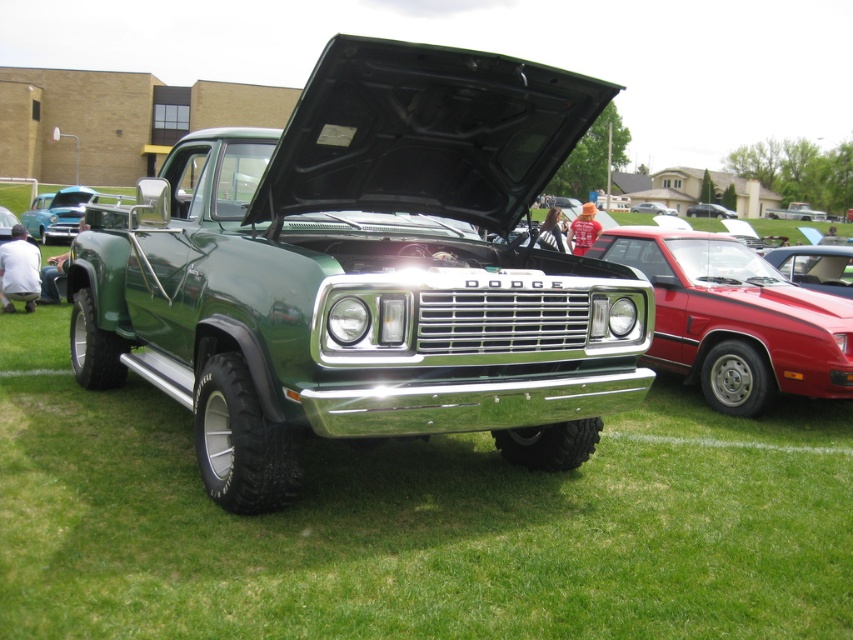
Does shiny red car at center have a lesser height compared to metallic silver sedan at center?

Correct, shiny red car at center is not as tall as metallic silver sedan at center.

The width and height of the screenshot is (853, 640). What do you see at coordinates (734, 317) in the screenshot?
I see `shiny red car at center` at bounding box center [734, 317].

Where is `shiny red car at center`? shiny red car at center is located at coordinates (734, 317).

In the scene shown: Is teal glossy sedan at center positioned at the back of metallic silver sedan at center?

No, teal glossy sedan at center is in front of metallic silver sedan at center.

Who is lower down, teal glossy sedan at center or metallic silver sedan at center?

teal glossy sedan at center

Identify the location of teal glossy sedan at center. (56, 212).

Between shiny red car at center and teal glossy sedan at center, which one appears on the right side from the viewer's perspective?

shiny red car at center is more to the right.

Does shiny red car at center appear over teal glossy sedan at center?

Incorrect, shiny red car at center is not positioned above teal glossy sedan at center.

Identify the location of shiny red car at center. (734, 317).